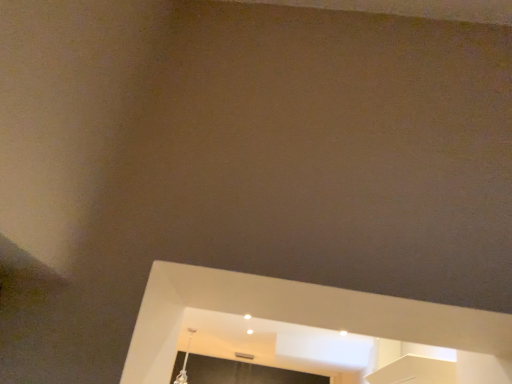
The height and width of the screenshot is (384, 512). What do you see at coordinates (293, 314) in the screenshot?
I see `white glossy window sill at lower center` at bounding box center [293, 314].

Image resolution: width=512 pixels, height=384 pixels. Identify the location of white glossy window sill at lower center. (293, 314).

At what (x,y) coordinates should I click in order to perform the action: click on white glossy window sill at lower center. Please return your answer as a coordinate pair (x, y). This screenshot has width=512, height=384. Looking at the image, I should click on (293, 314).